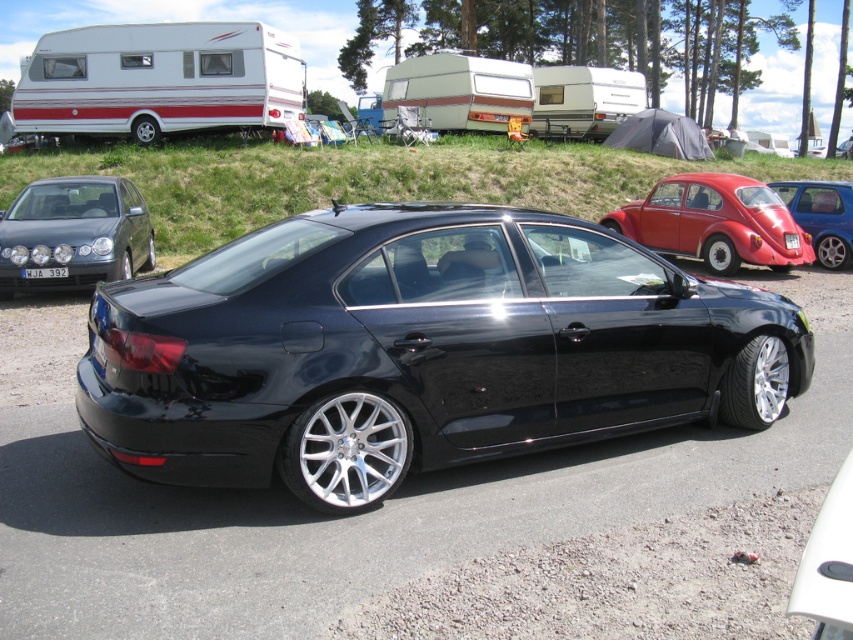
Which is above, satin silver sedan at center or black plastic license plate at center?

Positioned higher is black plastic license plate at center.

Image resolution: width=853 pixels, height=640 pixels. What do you see at coordinates (74, 232) in the screenshot?
I see `satin silver sedan at center` at bounding box center [74, 232].

Is point (91, 276) positioned in front of point (793, 236)?

Yes, point (91, 276) is closer to viewer.

This screenshot has width=853, height=640. I want to click on satin silver sedan at center, so click(74, 232).

Which of these two, white glossy caravan at upper left or white glossy bumper at lower right, stands shorter?

white glossy bumper at lower right

Can you confirm if white glossy caravan at upper left is positioned to the left of white glossy bumper at lower right?

Yes, white glossy caravan at upper left is to the left of white glossy bumper at lower right.

Is point (152, 129) positioned before point (834, 513)?

No, it is behind (834, 513).

Where is `white glossy caravan at upper left`? This screenshot has height=640, width=853. white glossy caravan at upper left is located at coordinates (160, 80).

Is glossy black sedan at center shorter than white glossy caravan at upper left?

Indeed, glossy black sedan at center has a lesser height compared to white glossy caravan at upper left.

Who is shorter, glossy black sedan at center or white glossy caravan at upper left?

glossy black sedan at center is shorter.

Find the location of `glossy black sedan at center`. glossy black sedan at center is located at coordinates (418, 349).

The height and width of the screenshot is (640, 853). In order to click on glossy black sedan at center in this screenshot , I will do `click(418, 349)`.